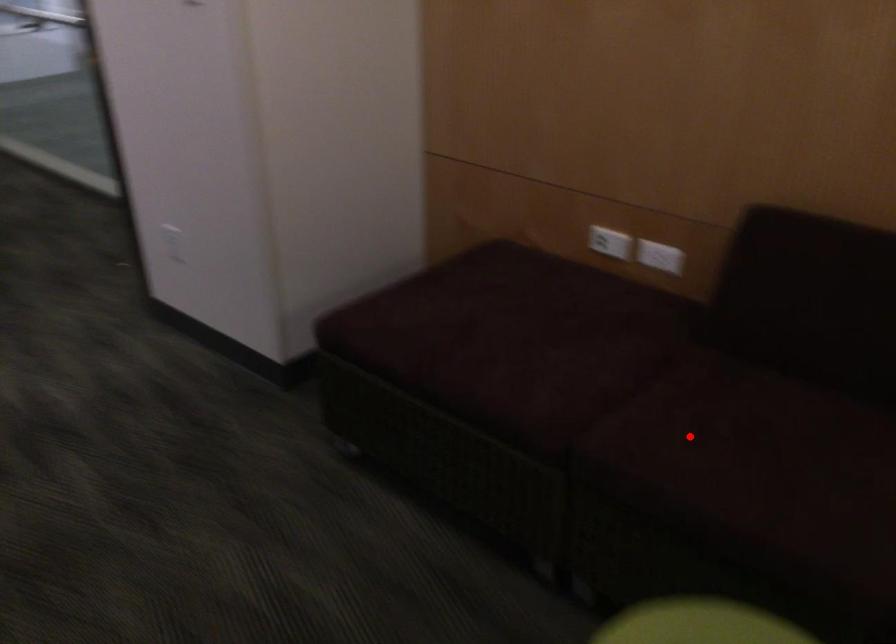
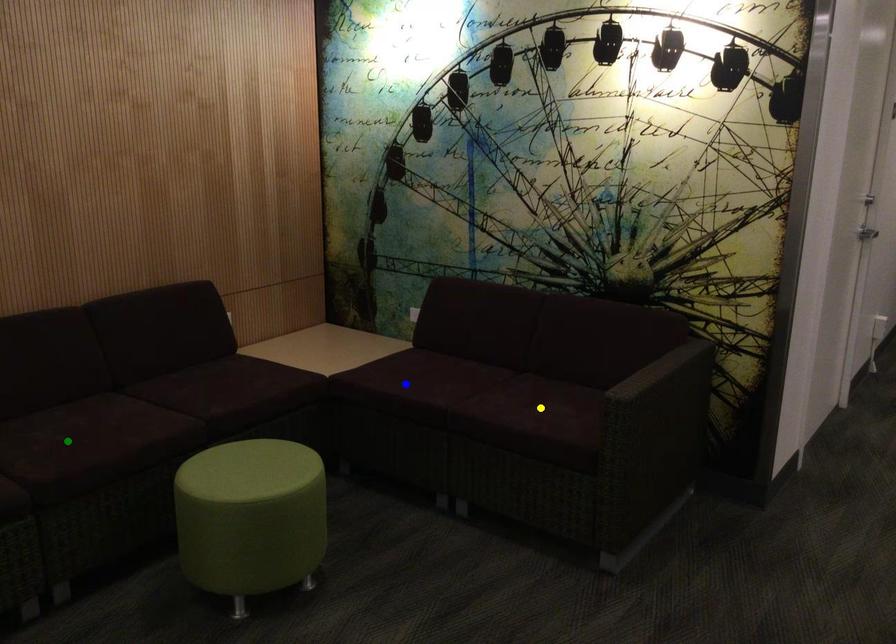
Question: I am providing you with two images of the same scene from different viewpoints. A red point is marked on the first image. You are given multiple points on the second image. Which mark in image 2 goes with the point in image 1?

Choices:
 (A) blue point
 (B) yellow point
 (C) green point

Answer: (C)